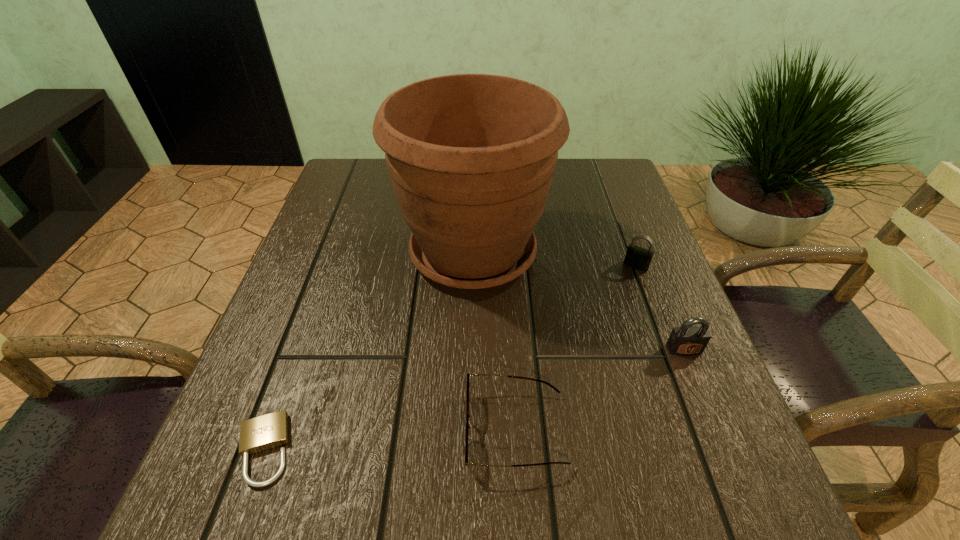
Where is `vacant space located on the face of the spectacles`? vacant space located on the face of the spectacles is located at coordinates (395, 430).

At what (x,y) coordinates should I click in order to perform the action: click on vacant space located on the face of the spectacles. Please return your answer as a coordinate pair (x, y). This screenshot has width=960, height=540. Looking at the image, I should click on (369, 430).

This screenshot has height=540, width=960. Identify the location of vacant space located 0.380m on the right of the leftmost object. (548, 449).

Identify the location of object that is at the far edge. Image resolution: width=960 pixels, height=540 pixels. (471, 157).

The width and height of the screenshot is (960, 540). In order to click on spectacles at the near edge in this screenshot , I will do `click(468, 374)`.

You are a GUI agent. You are given a task and a screenshot of the screen. Output one action in this format:
    pyautogui.click(x=<x>, y=<y>)
    Task: Click on the padlock that is at the near edge
    The width and height of the screenshot is (960, 540).
    Given the screenshot: What is the action you would take?
    pyautogui.click(x=264, y=432)

Find the location of a particular element. object that is at the left edge is located at coordinates (264, 432).

The width and height of the screenshot is (960, 540). Find the location of `object that is at the near left corner`. object that is at the near left corner is located at coordinates (264, 432).

This screenshot has height=540, width=960. I want to click on vacant space at the near edge of the desktop, so click(x=529, y=488).

Where is `vacant space at the left edge of the desktop`? The image size is (960, 540). vacant space at the left edge of the desktop is located at coordinates (338, 326).